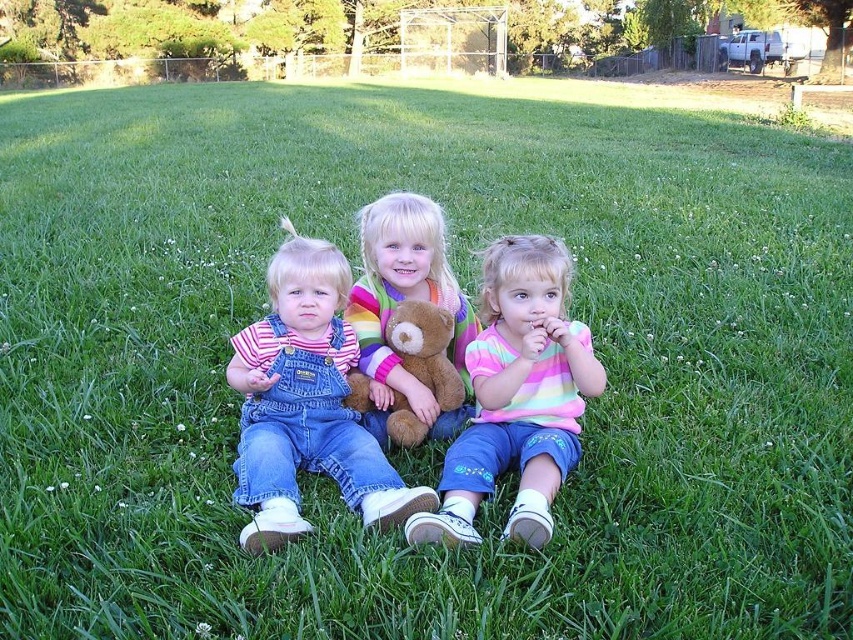
Does denim overalls at center have a lesser height compared to multicolored striped shirt at center?

Incorrect, denim overalls at center's height does not fall short of multicolored striped shirt at center's.

Is denim overalls at center above multicolored striped shirt at center?

No, denim overalls at center is not above multicolored striped shirt at center.

Does point (273, 532) come farther from viewer compared to point (448, 410)?

No, (273, 532) is in front of (448, 410).

You are a GUI agent. You are given a task and a screenshot of the screen. Output one action in this format:
    pyautogui.click(x=<x>, y=<y>)
    Task: Click on the denim overalls at center
    The width and height of the screenshot is (853, 640).
    Given the screenshot: What is the action you would take?
    pyautogui.click(x=306, y=403)

Measure the distance between denim overalls at center and striped cotton shirt at center.

A distance of 21.79 inches exists between denim overalls at center and striped cotton shirt at center.

Where is `denim overalls at center`? denim overalls at center is located at coordinates (306, 403).

Is point (560, 410) behind point (352, 323)?

No, (560, 410) is in front of (352, 323).

In the scene shown: Is striped cotton shirt at center positioned at the back of multicolored striped shirt at center?

No.

Image resolution: width=853 pixels, height=640 pixels. Identify the location of striped cotton shirt at center. (517, 396).

I want to click on striped cotton shirt at center, so click(517, 396).